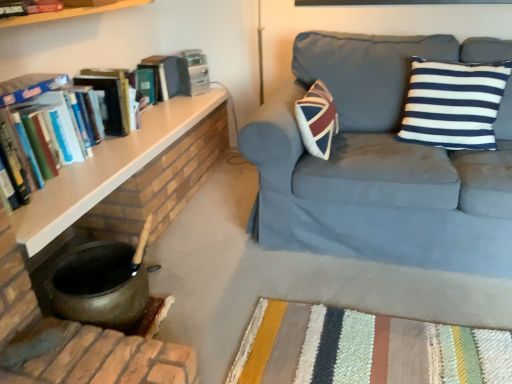
Question: Looking at their shapes, would you say suede blue couch at upper right is wider or thinner than hardcover book at upper left?

Choices:
 (A) wide
 (B) thin

Answer: (A)

Question: In the image, is suede blue couch at upper right positioned in front of or behind hardcover book at upper left?

Choices:
 (A) behind
 (B) front

Answer: (B)

Question: Which is farther from the wooden shelf at left?

Choices:
 (A) suede blue couch at upper right
 (B) navy blue striped cushion at upper right
 (C) hardcover books at left, which is the 1th book from bottom to top
 (D) hardcover book at upper left
 (E) hardcover book at upper left, placed as the second book when sorted from bottom to top

Answer: (B)

Question: Estimate the real-world distances between objects in this image. Which object is farther from the navy blue striped cushion at upper right?

Choices:
 (A) hardcover books at left, the 2th book positioned from the top
 (B) hardcover book at upper left, placed as the second book when sorted from bottom to top
 (C) hardcover book at upper left
 (D) wooden shelf at left
 (E) suede blue couch at upper right

Answer: (B)